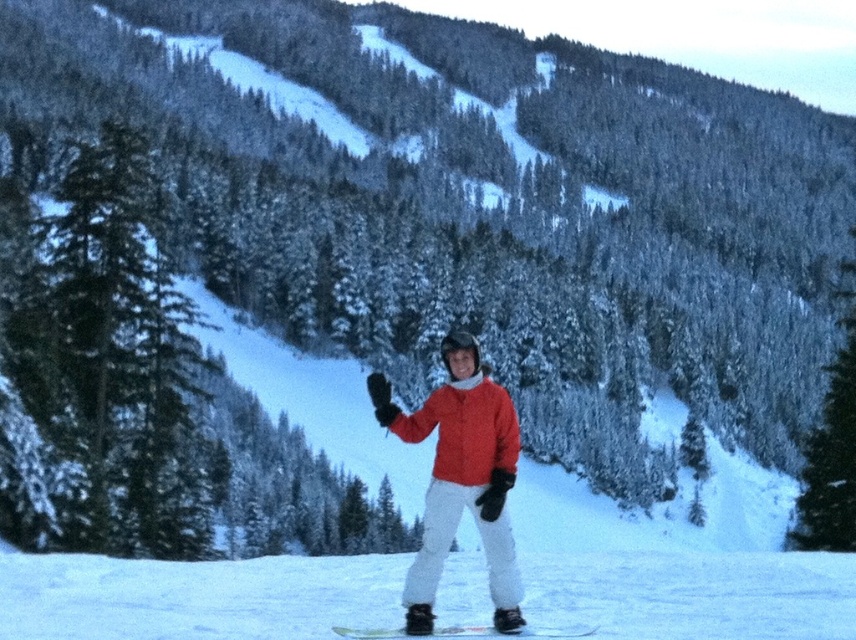
Question: Is matte red jacket at center smaller than green matte snowboard at center?

Choices:
 (A) yes
 (B) no

Answer: (B)

Question: Which of the following is the closest to the observer?

Choices:
 (A) green matte snowboard at center
 (B) green textured pine tree at left
 (C) matte red jacket at center

Answer: (A)

Question: Does green textured pine tree at left have a larger size compared to green matte snowboard at center?

Choices:
 (A) no
 (B) yes

Answer: (B)

Question: Estimate the real-world distances between objects in this image. Which object is farther from the matte red jacket at center?

Choices:
 (A) green textured pine tree at left
 (B) green matte snowboard at center

Answer: (A)

Question: Among these points, which one is farthest from the camera?

Choices:
 (A) (447, 497)
 (B) (383, 628)
 (C) (70, 294)

Answer: (C)

Question: Does green textured pine tree at left lie behind green matte snowboard at center?

Choices:
 (A) yes
 (B) no

Answer: (A)